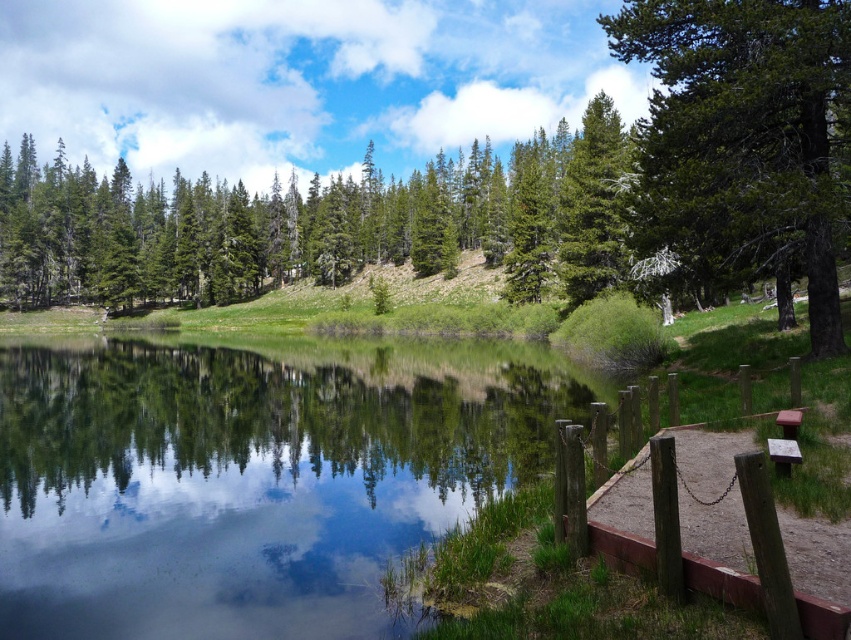
You are standing at the edge of the scene and want to walk towards the brown wooden picnic table at lower right. Which direction should you go relative to the brown wooden dock at lower right?

You should walk to the right of the brown wooden dock at lower right because the picnic table is located to the right of the dock.

You are standing at the center of the image and want to walk to the brown wooden dock at lower right. In which general direction should you move?

Since the brown wooden dock at lower right is located at coordinates approximately 0.861 on the x axis and 0.845 on the y axis, you should move towards the lower right direction to reach it.

You are planning to set up a small tent for a picnic. You have two options for locations near the water. The first is near the brown wooden dock at lower right, and the second is near the brown wooden picnic table at lower right. Which location has more space to set up the tent?

The brown wooden picnic table at lower right occupies more space than the brown wooden dock at lower right, so the location near the brown wooden picnic table at lower right has more space to set up the tent.